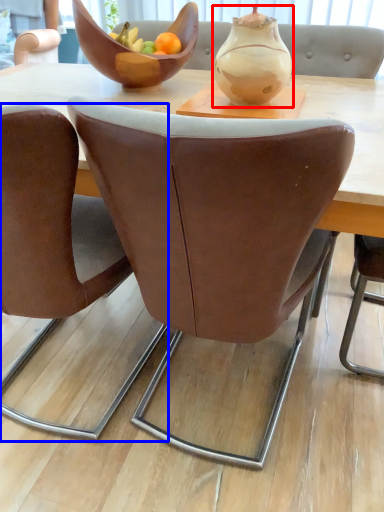
Question: Among these objects, which one is farthest to the camera, vase (highlighted by a red box) or chair (highlighted by a blue box)?

Choices:
 (A) vase
 (B) chair

Answer: (A)